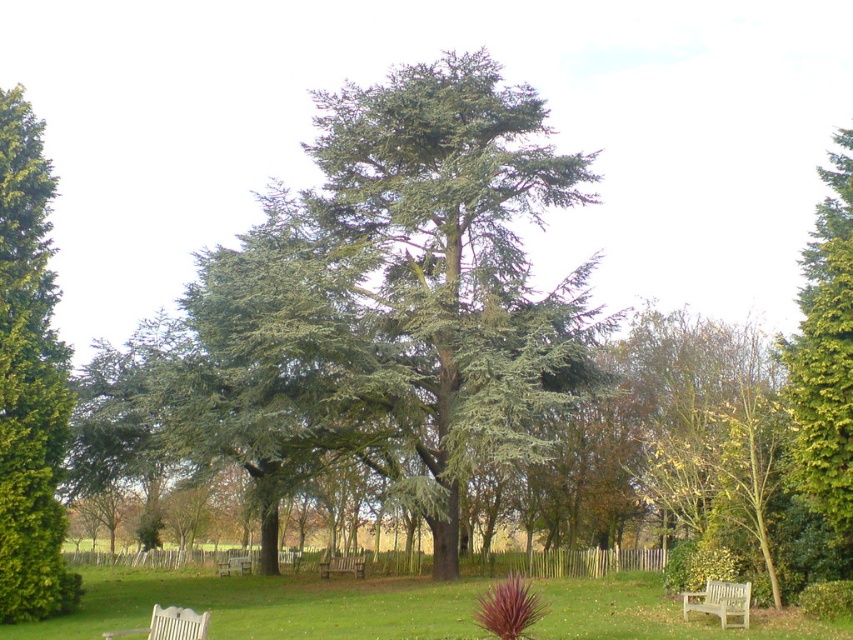
The height and width of the screenshot is (640, 853). What do you see at coordinates (825, 355) in the screenshot? I see `green textured tree at right` at bounding box center [825, 355].

Looking at this image, is green textured tree at right wider than wooden bench at lower center?

Indeed, green textured tree at right has a greater width compared to wooden bench at lower center.

Is point (805, 307) positioned after point (229, 566)?

No, it is in front of (229, 566).

Identify the location of green textured tree at right. The width and height of the screenshot is (853, 640). (825, 355).

Is green needle-like at center taller than green textured tree at right?

Yes, green needle-like at center is taller than green textured tree at right.

Which is above, green needle-like at center or green textured tree at right?

green needle-like at center is above.

Where is `green needle-like at center`? The height and width of the screenshot is (640, 853). green needle-like at center is located at coordinates (376, 308).

I want to click on green needle-like at center, so click(x=376, y=308).

Does wooden park bench at center have a greater width compared to wooden bench at lower center?

Incorrect, wooden park bench at center's width does not surpass wooden bench at lower center's.

Which is in front, point (361, 560) or point (223, 563)?

Positioned in front is point (361, 560).

Which is in front, point (347, 566) or point (235, 564)?

Positioned in front is point (347, 566).

The height and width of the screenshot is (640, 853). Identify the location of wooden park bench at center. 341,564.